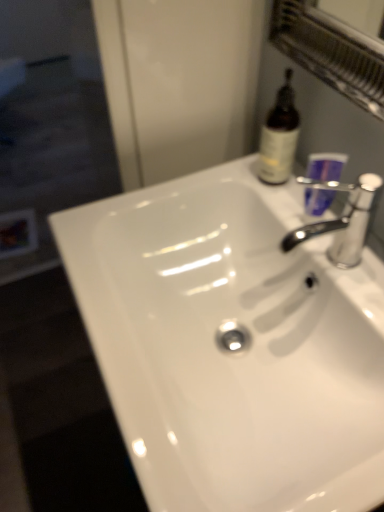
Question: Is point (344, 156) closer or farther from the camera than point (292, 330)?

Choices:
 (A) farther
 (B) closer

Answer: (B)

Question: Relative to white glossy sink at center, is purple plastic cup at upper right in front or behind?

Choices:
 (A) behind
 (B) front

Answer: (A)

Question: Estimate the real-world distances between objects in this image. Which object is farther from the brown glass bottle at upper right?

Choices:
 (A) purple plastic cup at upper right
 (B) silver metallic faucet at upper right
 (C) white glossy sink at center
 (D) transparent glass screen door at left

Answer: (D)

Question: Considering the real-world distances, which object is closest to the silver metallic faucet at upper right?

Choices:
 (A) purple plastic cup at upper right
 (B) transparent glass screen door at left
 (C) brown glass bottle at upper right
 (D) white glossy sink at center

Answer: (A)